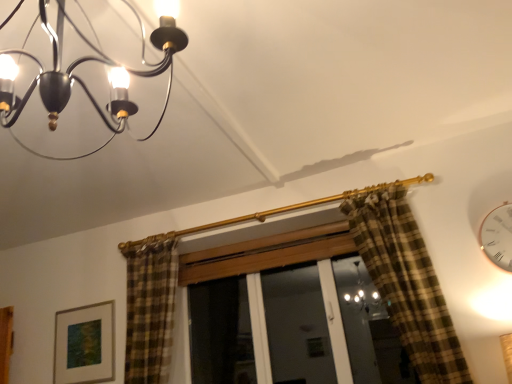
Question: Choose the correct answer: Is matte black chandelier at upper left inside white glossy clock at upper right or outside it?

Choices:
 (A) outside
 (B) inside

Answer: (A)

Question: Looking at their shapes, would you say matte black chandelier at upper left is wider or thinner than white glossy clock at upper right?

Choices:
 (A) thin
 (B) wide

Answer: (B)

Question: Estimate the real-world distances between objects in this image. Which object is farther from the white glossy clock at upper right?

Choices:
 (A) matte black chandelier at upper left
 (B) matte gold picture frame at lower left

Answer: (B)

Question: Estimate the real-world distances between objects in this image. Which object is closer to the white glossy clock at upper right?

Choices:
 (A) matte gold picture frame at lower left
 (B) matte black chandelier at upper left

Answer: (B)